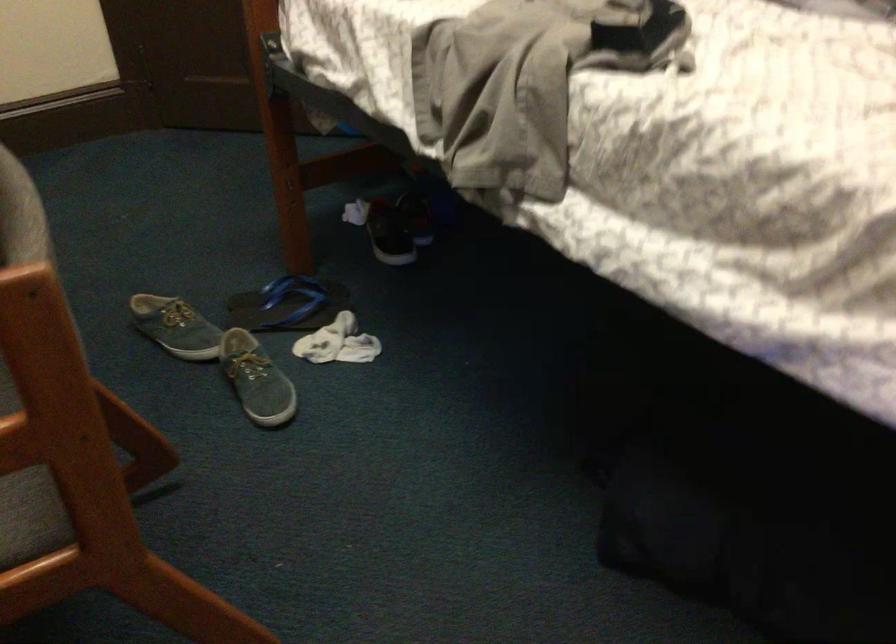
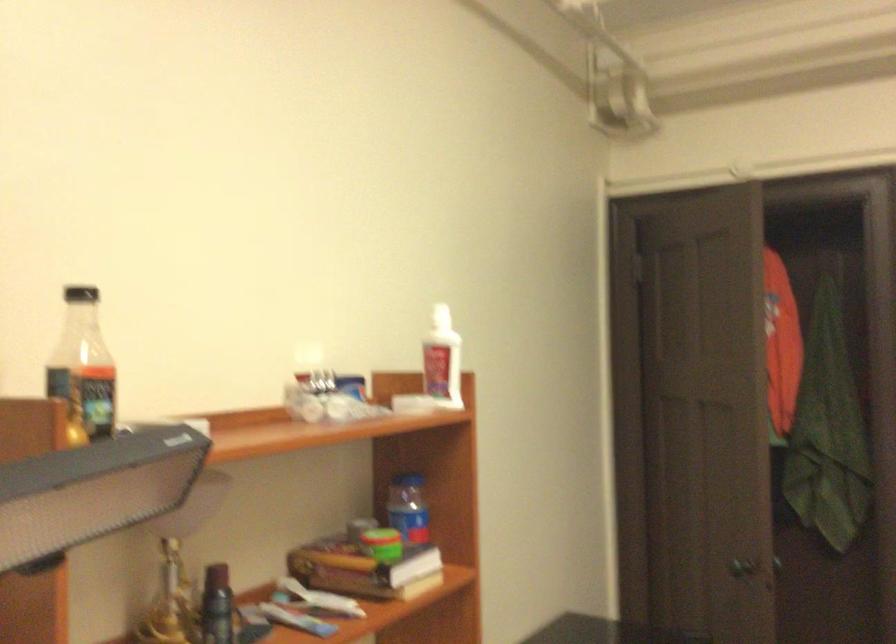
Question: The camera is either moving clockwise (left) or counter-clockwise (right) around the object. The first image is from the beginning of the video and the second image is from the end. Is the camera moving left or right when shooting the video?

Choices:
 (A) Left
 (B) Right

Answer: (B)